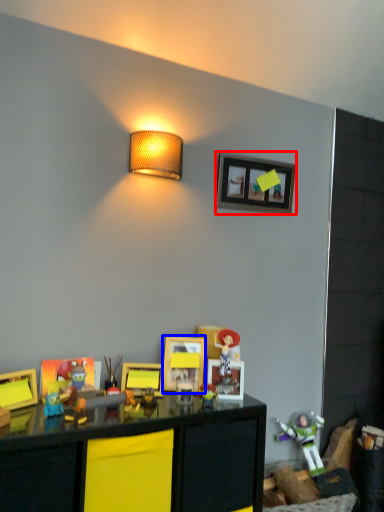
Question: Which of the following is the farthest to the observer, picture frame (highlighted by a red box) or picture frame (highlighted by a blue box)?

Choices:
 (A) picture frame
 (B) picture frame

Answer: (A)